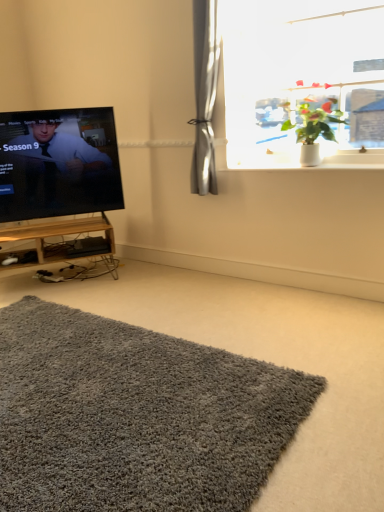
Question: Can you confirm if white glossy window sill at upper right is taller than black glossy tv at left?

Choices:
 (A) yes
 (B) no

Answer: (B)

Question: From the image's perspective, would you say white glossy window sill at upper right is shown under black glossy tv at left?

Choices:
 (A) no
 (B) yes

Answer: (B)

Question: From the image's perspective, is white glossy window sill at upper right on top of black glossy tv at left?

Choices:
 (A) no
 (B) yes

Answer: (A)

Question: Is white glossy window sill at upper right positioned with its back to black glossy tv at left?

Choices:
 (A) no
 (B) yes

Answer: (A)

Question: Is black glossy tv at left completely or partially inside white glossy window sill at upper right?

Choices:
 (A) yes
 (B) no

Answer: (B)

Question: From a real-world perspective, is white glossy window sill at upper right beneath black glossy tv at left?

Choices:
 (A) yes
 (B) no

Answer: (A)

Question: Can you confirm if black glossy tv at left is wider than white glossy window sill at upper right?

Choices:
 (A) no
 (B) yes

Answer: (B)

Question: Does black glossy tv at left have a lesser width compared to white glossy window sill at upper right?

Choices:
 (A) no
 (B) yes

Answer: (A)

Question: Can you confirm if black glossy tv at left is smaller than white glossy window sill at upper right?

Choices:
 (A) no
 (B) yes

Answer: (A)

Question: From the image's perspective, does black glossy tv at left appear higher than white glossy window sill at upper right?

Choices:
 (A) yes
 (B) no

Answer: (A)

Question: Considering the relative positions of black glossy tv at left and white glossy window sill at upper right in the image provided, is black glossy tv at left in front of white glossy window sill at upper right?

Choices:
 (A) no
 (B) yes

Answer: (A)

Question: Is white glossy window sill at upper right a part of black glossy tv at left?

Choices:
 (A) yes
 (B) no

Answer: (B)

Question: Considering the relative positions of green leafy plant at upper right and woodenmaterial tv stand at left in the image provided, is green leafy plant at upper right to the left of woodenmaterial tv stand at left from the viewer's perspective?

Choices:
 (A) yes
 (B) no

Answer: (B)